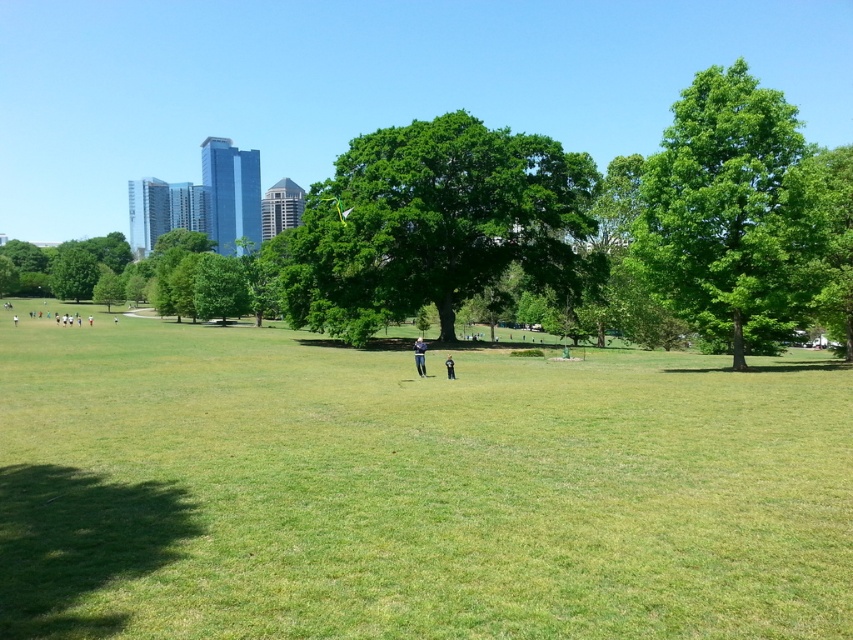
Based on the photo, between green grassy field at center and green leafy tree at right, which one has more height?

green leafy tree at right is taller.

From the picture: Does green grassy field at center appear on the right side of green leafy tree at right?

No, green grassy field at center is not to the right of green leafy tree at right.

Locate an element on the screen. This screenshot has height=640, width=853. green grassy field at center is located at coordinates (413, 490).

Identify the location of green grassy field at center. (413, 490).

Which of these two, green leafy tree at center or green leafy tree at right, stands shorter?

With less height is green leafy tree at right.

The width and height of the screenshot is (853, 640). Describe the element at coordinates (436, 225) in the screenshot. I see `green leafy tree at center` at that location.

Identify the location of green leafy tree at center. The image size is (853, 640). (436, 225).

Who is shorter, green grassy field at center or light blue denim jeans at center?

green grassy field at center

Does green grassy field at center appear on the right side of light blue denim jeans at center?

Correct, you'll find green grassy field at center to the right of light blue denim jeans at center.

Which is behind, point (204, 380) or point (424, 369)?

Positioned behind is point (424, 369).

Find the location of `green grassy field at center`. green grassy field at center is located at coordinates (413, 490).